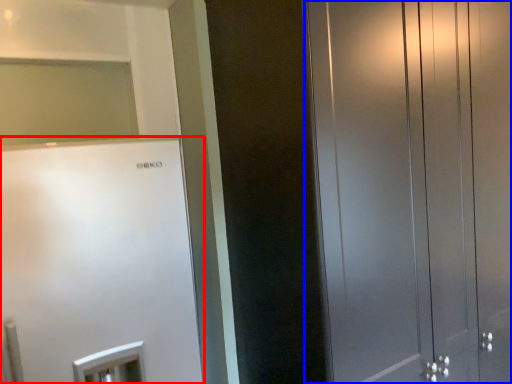
Question: Which object is closer to the camera taking this photo, refrigerator (highlighted by a red box) or door (highlighted by a blue box)?

Choices:
 (A) refrigerator
 (B) door

Answer: (A)